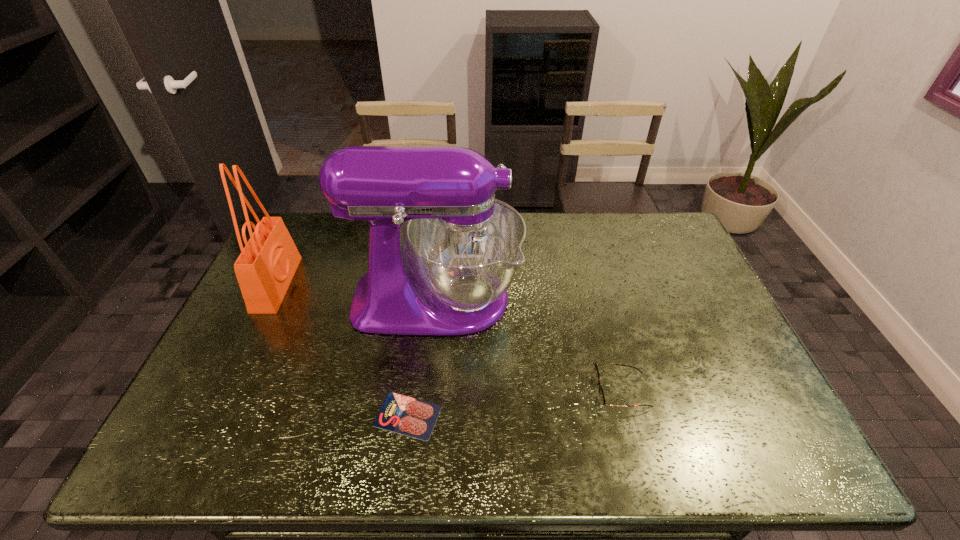
Locate an element on the screen. This screenshot has width=960, height=540. mixer is located at coordinates (449, 275).

Where is `tote bag`? tote bag is located at coordinates (265, 268).

This screenshot has width=960, height=540. Find the location of `the leftmost object`. the leftmost object is located at coordinates (265, 268).

At what (x,y) coordinates should I click in order to perform the action: click on spectacles. Please return your answer as a coordinate pair (x, y). Looking at the image, I should click on (596, 373).

I want to click on the second shortest object, so click(596, 373).

The height and width of the screenshot is (540, 960). In order to click on the shortest object in this screenshot , I will do `click(401, 414)`.

I want to click on vacant area situated at the bowl opening of the tallest object, so click(x=622, y=300).

Locate an element on the screen. vacant space located on the logo side of the tote bag is located at coordinates (335, 284).

Identify the location of blank space located on the face of the spectacles. tap(562, 392).

Where is `free space located on the face of the spectacles`? The image size is (960, 540). free space located on the face of the spectacles is located at coordinates (533, 392).